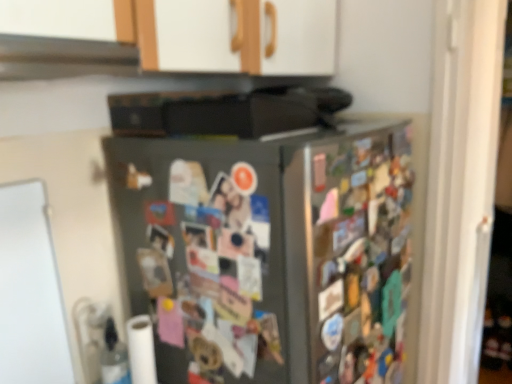
Question: Should I look upward or downward to see white matte toilet paper at lower left?

Choices:
 (A) down
 (B) up

Answer: (A)

Question: Considering the relative sizes of white matte toilet paper at lower left and satin silver refrigerator at center in the image provided, is white matte toilet paper at lower left smaller than satin silver refrigerator at center?

Choices:
 (A) no
 (B) yes

Answer: (B)

Question: Is white matte toilet paper at lower left touching satin silver refrigerator at center?

Choices:
 (A) yes
 (B) no

Answer: (B)

Question: From the image's perspective, does white matte toilet paper at lower left appear higher than satin silver refrigerator at center?

Choices:
 (A) no
 (B) yes

Answer: (A)

Question: Can you confirm if white matte toilet paper at lower left is shorter than satin silver refrigerator at center?

Choices:
 (A) no
 (B) yes

Answer: (B)

Question: Does white matte toilet paper at lower left appear on the right side of satin silver refrigerator at center?

Choices:
 (A) no
 (B) yes

Answer: (A)

Question: Is white matte toilet paper at lower left bigger than satin silver refrigerator at center?

Choices:
 (A) yes
 (B) no

Answer: (B)

Question: Does satin silver refrigerator at center have a lesser height compared to white matte toilet paper at lower left?

Choices:
 (A) yes
 (B) no

Answer: (B)

Question: Can you confirm if satin silver refrigerator at center is smaller than white matte toilet paper at lower left?

Choices:
 (A) yes
 (B) no

Answer: (B)

Question: Is satin silver refrigerator at center far from white matte toilet paper at lower left?

Choices:
 (A) no
 (B) yes

Answer: (A)

Question: Would you say satin silver refrigerator at center contains white matte toilet paper at lower left?

Choices:
 (A) yes
 (B) no

Answer: (B)

Question: From a real-world perspective, is satin silver refrigerator at center physically below white matte toilet paper at lower left?

Choices:
 (A) yes
 (B) no

Answer: (B)

Question: Considering the relative sizes of satin silver refrigerator at center and white matte toilet paper at lower left in the image provided, is satin silver refrigerator at center taller than white matte toilet paper at lower left?

Choices:
 (A) no
 (B) yes

Answer: (B)

Question: Is black matte exhaust hood at upper center positioned before satin silver refrigerator at center?

Choices:
 (A) no
 (B) yes

Answer: (B)